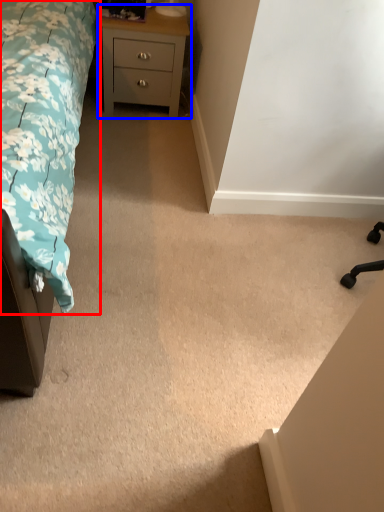
Question: Which point is closer to the camera, bed (highlighted by a red box) or chest of drawers (highlighted by a blue box)?

Choices:
 (A) bed
 (B) chest of drawers

Answer: (A)